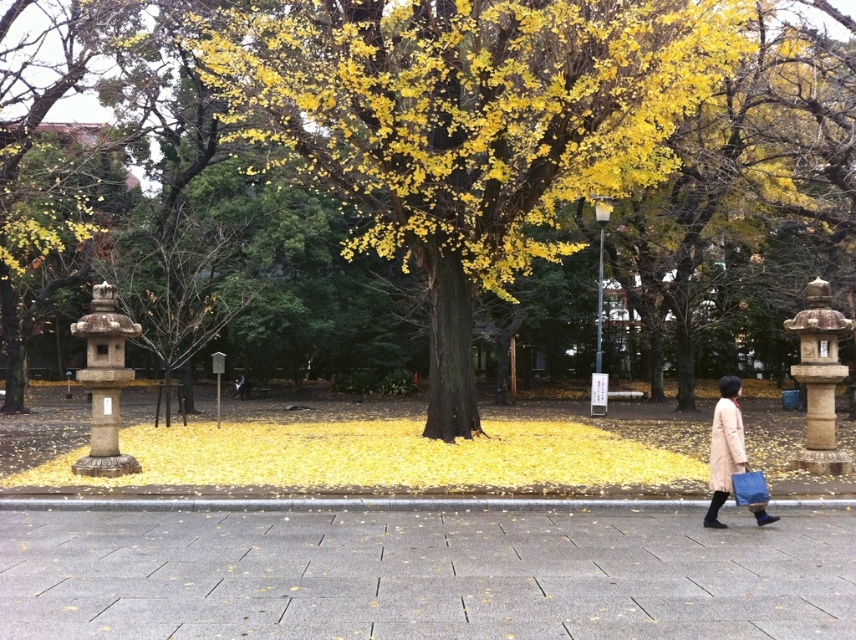
Which of these two, yellow leafy tree at center or gray concrete pavement at center, stands taller?

yellow leafy tree at center

Find the location of a particular element. yellow leafy tree at center is located at coordinates (468, 125).

The width and height of the screenshot is (856, 640). I want to click on yellow leafy tree at center, so click(468, 125).

Does yellow leafy tree at center appear on the right side of beige wool coat at lower right?

Incorrect, yellow leafy tree at center is not on the right side of beige wool coat at lower right.

Between yellow leafy tree at center and beige wool coat at lower right, which one is positioned lower?

beige wool coat at lower right is below.

Who is more forward, (694,52) or (708,461)?

Positioned in front is point (708,461).

The image size is (856, 640). Identify the location of yellow leafy tree at center. (468, 125).

Does beige wool coat at lower right come behind light beige wool coat at lower right?

That is False.

Who is taller, beige wool coat at lower right or light beige wool coat at lower right?

beige wool coat at lower right

Find the location of a particular element. The image size is (856, 640). beige wool coat at lower right is located at coordinates (724, 448).